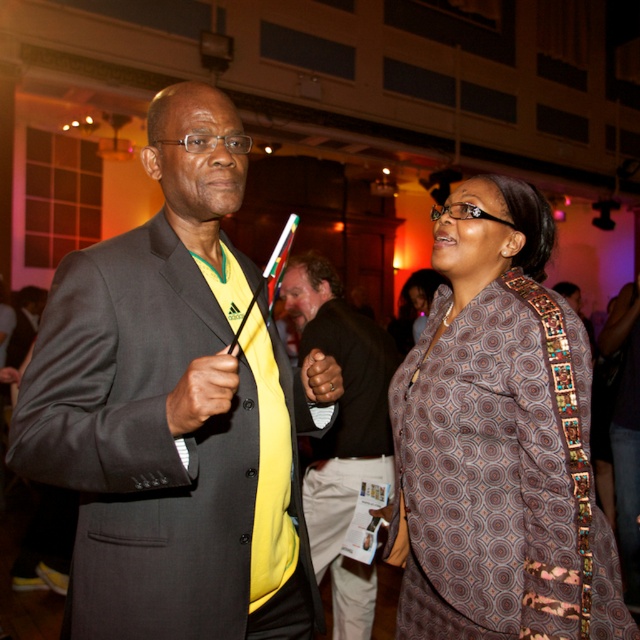
Based on the photo, is matte black suit at center to the left of brown printed fabric dress at right from the viewer's perspective?

Indeed, matte black suit at center is positioned on the left side of brown printed fabric dress at right.

Locate an element on the screen. This screenshot has height=640, width=640. matte black suit at center is located at coordinates (173, 410).

Is point (86, 618) positioned after point (432, 324)?

No.

Where is `matte black suit at center`? This screenshot has height=640, width=640. matte black suit at center is located at coordinates (173, 410).

In the scene shown: Which is more to the right, brown printed fabric dress at right or yellow fabric shirt at center?

brown printed fabric dress at right

Between brown printed fabric dress at right and yellow fabric shirt at center, which one is positioned lower?

Positioned lower is yellow fabric shirt at center.

This screenshot has height=640, width=640. What are the coordinates of `brown printed fabric dress at right` in the screenshot? It's located at (499, 440).

Is matte black suit at center wider than yellow fabric shirt at center?

Yes.

Between point (195, 404) and point (332, 449), which one is positioned in front?

Point (195, 404) is more forward.

Locate an element on the screen. Image resolution: width=640 pixels, height=640 pixels. matte black suit at center is located at coordinates (173, 410).